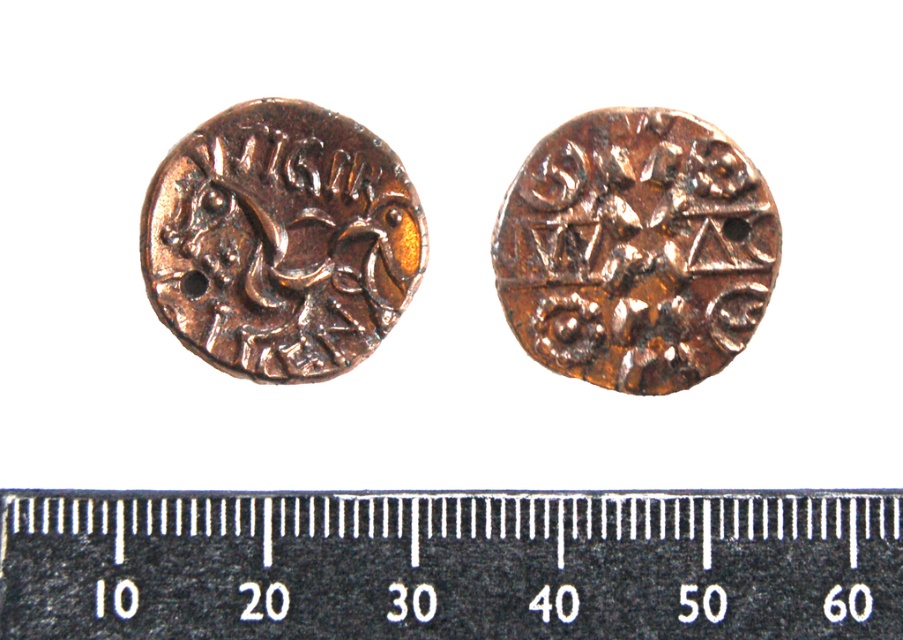
Question: Which of the following is the farthest from the observer?

Choices:
 (A) bronze textured coin at upper left
 (B) black metal ruler at bottom

Answer: (A)

Question: Does black metal ruler at bottom have a smaller size compared to rusty copper coin at center?

Choices:
 (A) yes
 (B) no

Answer: (B)

Question: Can you confirm if black metal ruler at bottom is positioned to the left of bronze textured coin at upper left?

Choices:
 (A) no
 (B) yes

Answer: (A)

Question: Does black metal ruler at bottom appear on the left side of bronze textured coin at upper left?

Choices:
 (A) yes
 (B) no

Answer: (B)

Question: Which point is closer to the camera?

Choices:
 (A) 233,620
 (B) 210,266
 (C) 513,264

Answer: (A)

Question: Which of the following is the closest to the observer?

Choices:
 (A) bronze textured coin at upper left
 (B) black metal ruler at bottom
 (C) rusty copper coin at center

Answer: (B)